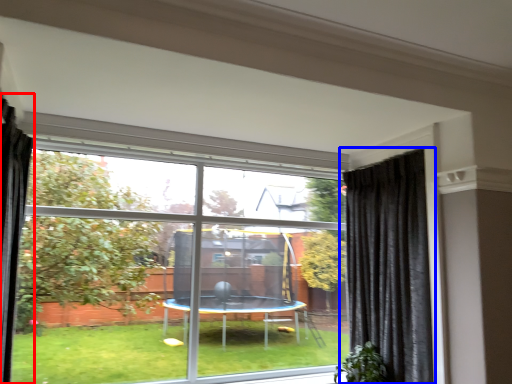
Question: Which object appears closest to the camera in this image, curtain (highlighted by a red box) or curtain (highlighted by a blue box)?

Choices:
 (A) curtain
 (B) curtain

Answer: (A)